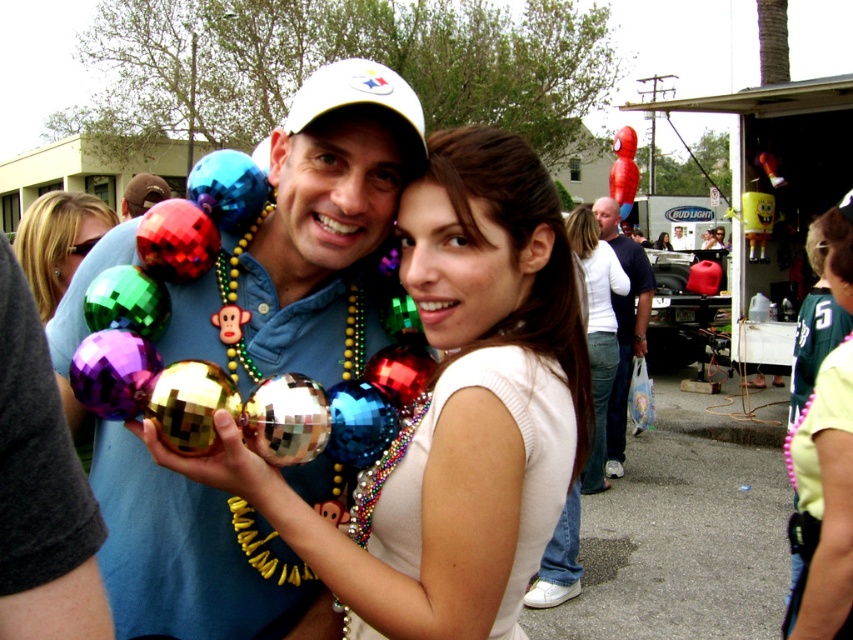
You are a photographer trying to capture a closeup of both the shiny metallic ornaments at center and the pink beaded necklace at center. Since you can only focus on one object at a time, which one should you choose to ensure the other is still in the frame?

The shiny metallic ornaments at center is positioned on the left side of pink beaded necklace at center, so if you focus on the pink beaded necklace at center, the shiny metallic ornaments at center will still be in the frame to the left.

You are a photographer at the event and want to capture a photo of both the white matte shirt at center and the matte white shirt at center. Since both are wearing white shirts, how can you distinguish them in the photo?

The white matte shirt at center is to the left of matte white shirt at center, so you can distinguish them by their positions in the photo.

You are a photographer trying to capture the pink beaded necklace at center in your shot. The camera is positioned to focus on the individual on the left. Based on the coordinates provided, will the necklace be in the frame?

The pink beaded necklace at center is located at coordinates point (822, 504), which is within the frame since the camera is focused on the individual on the left who is in the foreground. Therefore, the necklace should be visible in the photo.